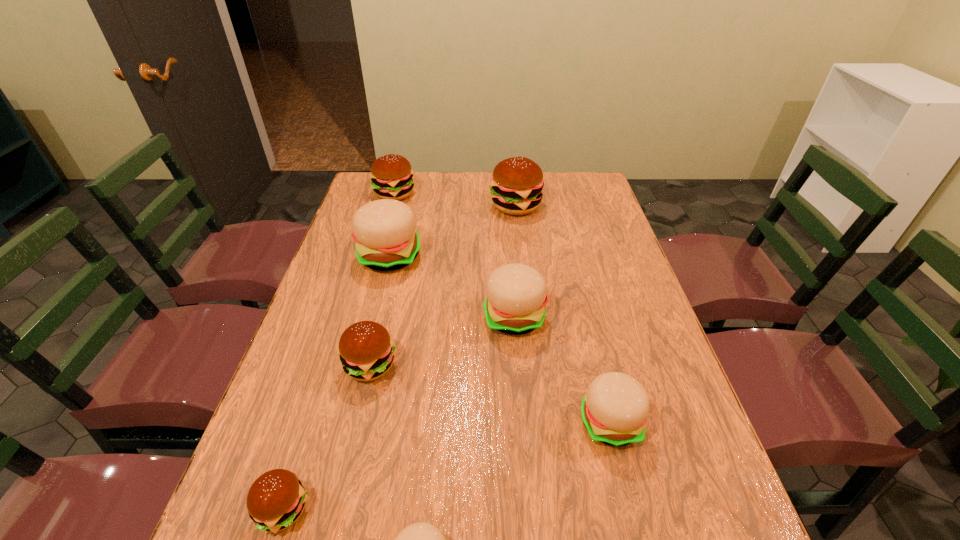
Find the location of a particular element. The image size is (960, 540). vacant space at the far edge is located at coordinates (461, 175).

The width and height of the screenshot is (960, 540). Find the location of `vacant space at the left edge`. vacant space at the left edge is located at coordinates (287, 362).

In the image, there is a desktop. In order to click on vacant space at the right edge in this screenshot , I will do `click(591, 225)`.

Locate an element on the screen. This screenshot has height=540, width=960. vacant space in between the second biggest brown hamburger and the rightmost brown hamburger is located at coordinates (455, 200).

Locate an element on the screen. empty space that is in between the third nearest beige hamburger and the second biggest brown hamburger is located at coordinates (454, 255).

Locate an element on the screen. Image resolution: width=960 pixels, height=540 pixels. vacant space in between the third smallest brown hamburger and the fourth nearest hamburger is located at coordinates (382, 280).

This screenshot has width=960, height=540. I want to click on free space between the fourth nearest object and the third smallest brown hamburger, so click(x=382, y=280).

Locate an element on the screen. Image resolution: width=960 pixels, height=540 pixels. free area in between the rightmost brown hamburger and the second nearest beige hamburger is located at coordinates (563, 314).

Identify the location of free spot between the fifth farthest hamburger and the second smallest beige hamburger. Image resolution: width=960 pixels, height=540 pixels. (490, 394).

Identify the location of unoccupied area between the rightmost brown hamburger and the second farthest beige hamburger. The width and height of the screenshot is (960, 540). (516, 261).